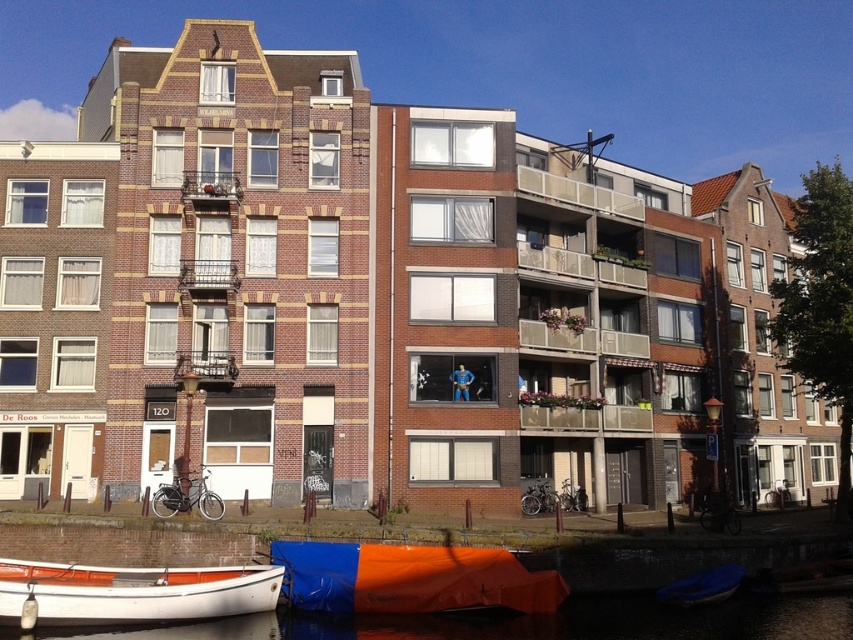
Question: Which point is farther from the camera taking this photo?

Choices:
 (A) (195, 193)
 (B) (694, 577)

Answer: (A)

Question: Is matte brown balcony at center in front of matte brick balcony at upper center?

Choices:
 (A) yes
 (B) no

Answer: (A)

Question: Can you confirm if orange tarpaulin boat at lower center is thinner than matte brick balcony at upper center?

Choices:
 (A) no
 (B) yes

Answer: (A)

Question: Can you confirm if orange tarpaulin boat at lower center is positioned to the left of white glossy boat at lower left?

Choices:
 (A) no
 (B) yes

Answer: (A)

Question: Which point is farther to the camera?

Choices:
 (A) (196, 365)
 (B) (561, 604)
 (C) (378, 576)

Answer: (A)

Question: Considering the real-world distances, which object is farthest from the smooth dark water at lower center?

Choices:
 (A) white glossy boat at lower left
 (B) blue fabric boat at lower center

Answer: (A)